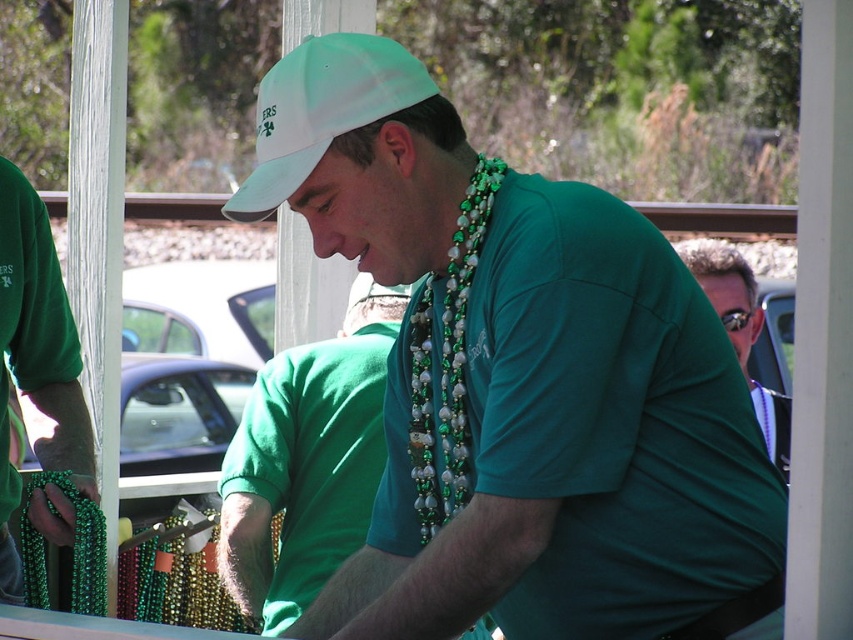
How distant is green pearl beads at center from matte green shirt at center?

green pearl beads at center and matte green shirt at center are 1.67 meters apart from each other.

Which is above, green pearl beads at center or matte green shirt at center?

green pearl beads at center is higher up.

Where is `green pearl beads at center`? green pearl beads at center is located at coordinates (447, 362).

I want to click on green pearl beads at center, so click(447, 362).

Is the position of green matte cap at center more distant than that of green matte shirt at center?

No, green matte cap at center is in front of green matte shirt at center.

This screenshot has height=640, width=853. In order to click on green matte cap at center in this screenshot , I will do `click(519, 381)`.

Between green matte cap at center and matte green shirt at center, which one appears on the left side from the viewer's perspective?

From the viewer's perspective, green matte cap at center appears more on the left side.

Is green matte cap at center to the right of matte green shirt at center from the viewer's perspective?

No, green matte cap at center is not to the right of matte green shirt at center.

The width and height of the screenshot is (853, 640). I want to click on green matte cap at center, so click(x=519, y=381).